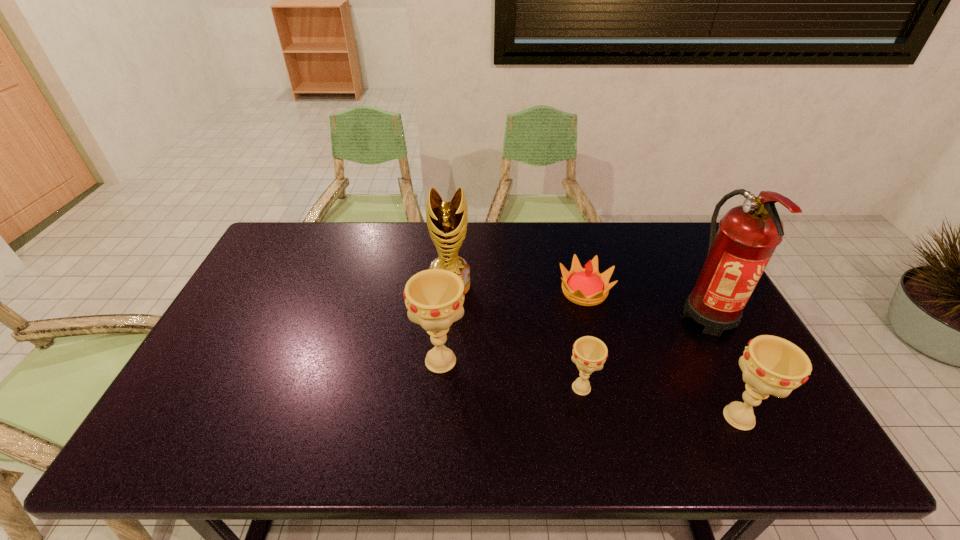
The width and height of the screenshot is (960, 540). What are the coordinates of `free space located on the back of the third shortest object` in the screenshot? It's located at (708, 354).

Where is `vacant space located 0.330m on the front of the crown`? vacant space located 0.330m on the front of the crown is located at coordinates (615, 410).

Where is `free point located on the front-facing side of the fire extinguisher`? free point located on the front-facing side of the fire extinguisher is located at coordinates (757, 406).

The width and height of the screenshot is (960, 540). I want to click on vacant space located 0.260m on the front-facing side of the fifth shortest object, so click(444, 369).

Where is `chalice that is at the right edge`? The height and width of the screenshot is (540, 960). chalice that is at the right edge is located at coordinates (771, 365).

I want to click on fire extinguisher that is at the right edge, so click(748, 234).

At what (x,y) coordinates should I click in order to perform the action: click on object that is at the near right corner. Please return your answer as a coordinate pair (x, y). The height and width of the screenshot is (540, 960). Looking at the image, I should click on (771, 365).

This screenshot has height=540, width=960. I want to click on free point at the far edge, so click(567, 229).

This screenshot has height=540, width=960. I want to click on free space at the near edge, so click(x=332, y=417).

Image resolution: width=960 pixels, height=540 pixels. In order to click on free space at the left edge in this screenshot , I will do `click(257, 366)`.